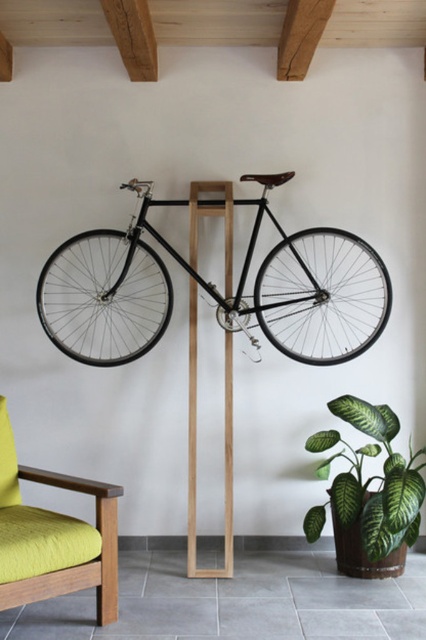
Question: Which point is farther to the camera?

Choices:
 (A) wooden beam at center
 (B) green matte leafy plant at lower right

Answer: (A)

Question: Among these objects, which one is nearest to the camera?

Choices:
 (A) green matte leafy plant at lower right
 (B) lime green fabric couch at lower left

Answer: (B)

Question: Which object appears farthest from the camera in this image?

Choices:
 (A) lime green fabric couch at lower left
 (B) wooden beam at center

Answer: (B)

Question: Does shiny black bicycle at center have a greater width compared to wooden beam at center?

Choices:
 (A) yes
 (B) no

Answer: (A)

Question: Is green matte leafy plant at lower right in front of wooden beam at center?

Choices:
 (A) yes
 (B) no

Answer: (A)

Question: Does green matte leafy plant at lower right have a larger size compared to wooden beam at center?

Choices:
 (A) no
 (B) yes

Answer: (B)